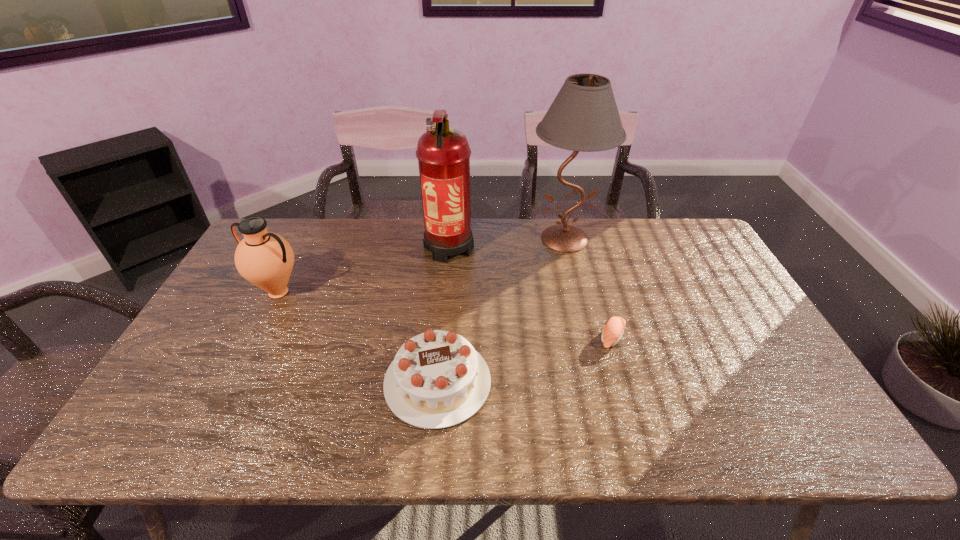
Locate an element on the screen. The image size is (960, 540). table lamp is located at coordinates (584, 117).

Identify the location of fire extinguisher. (443, 153).

The image size is (960, 540). Find the location of `the third farthest object`. the third farthest object is located at coordinates (265, 259).

Where is `pitcher`? The width and height of the screenshot is (960, 540). pitcher is located at coordinates click(x=265, y=259).

Identify the location of the fourth tallest object. (437, 379).

Find the location of a particular element. sushi is located at coordinates (614, 328).

I want to click on vacant region located on the front-facing side of the table lamp, so click(x=580, y=299).

The image size is (960, 540). Identify the location of vacant space situated 0.100m on the front-facing side of the fire extinguisher. (444, 294).

You are a GUI agent. You are given a task and a screenshot of the screen. Output one action in this format:
    pyautogui.click(x=<x>, y=<y>)
    Task: Click on the vacant space positioned on the left of the leftmost object
    
    Given the screenshot: What is the action you would take?
    pyautogui.click(x=234, y=293)

This screenshot has width=960, height=540. What are the coordinates of `free space located 0.380m on the right of the birthday cake` in the screenshot? It's located at (647, 382).